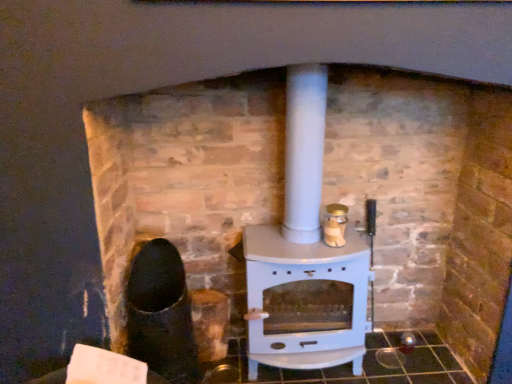
Question: From the image's perspective, relative to gold metallic jar at center-right, is white glossy wood burning stove at center above or below?

Choices:
 (A) below
 (B) above

Answer: (A)

Question: Considering the positions of point (271, 241) and point (338, 218), is point (271, 241) closer or farther from the camera than point (338, 218)?

Choices:
 (A) closer
 (B) farther

Answer: (B)

Question: Considering their positions, is white glossy wood burning stove at center located in front of or behind gold metallic jar at center-right?

Choices:
 (A) behind
 (B) front

Answer: (B)

Question: Considering the positions of gold metallic jar at center-right and white glossy wood burning stove at center in the image, is gold metallic jar at center-right wider or thinner than white glossy wood burning stove at center?

Choices:
 (A) wide
 (B) thin

Answer: (B)

Question: Is gold metallic jar at center-right inside or outside of white glossy wood burning stove at center?

Choices:
 (A) inside
 (B) outside

Answer: (A)

Question: From the image's perspective, is gold metallic jar at center-right located above or below white glossy wood burning stove at center?

Choices:
 (A) below
 (B) above

Answer: (B)

Question: Is point (340, 203) closer or farther from the camera than point (288, 349)?

Choices:
 (A) farther
 (B) closer

Answer: (A)